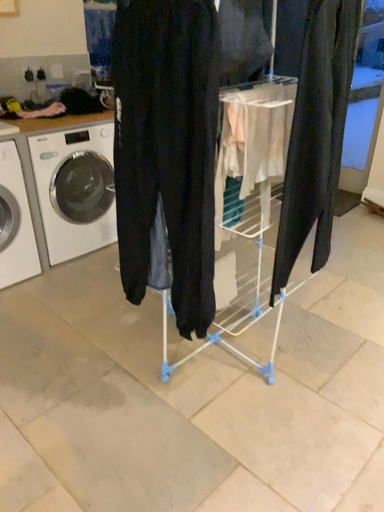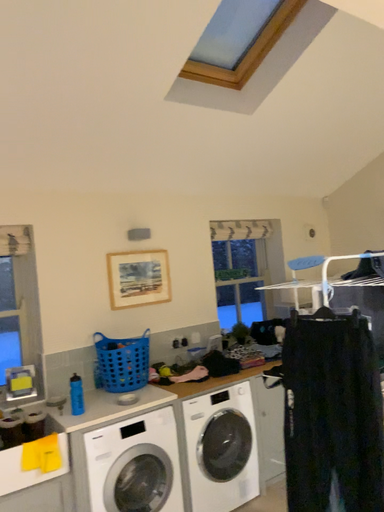
Question: How did the camera likely rotate when shooting the video?

Choices:
 (A) rotated upward
 (B) rotated downward

Answer: (A)